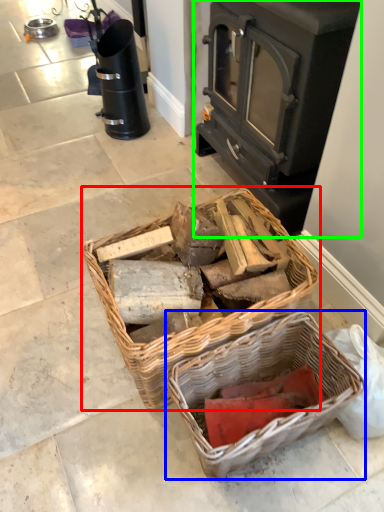
Question: Considering the real-world distances, which object is farthest from picnic basket (highlighted by a red box)? picnic basket (highlighted by a blue box) or wood burning stove (highlighted by a green box)?

Choices:
 (A) picnic basket
 (B) wood burning stove

Answer: (B)